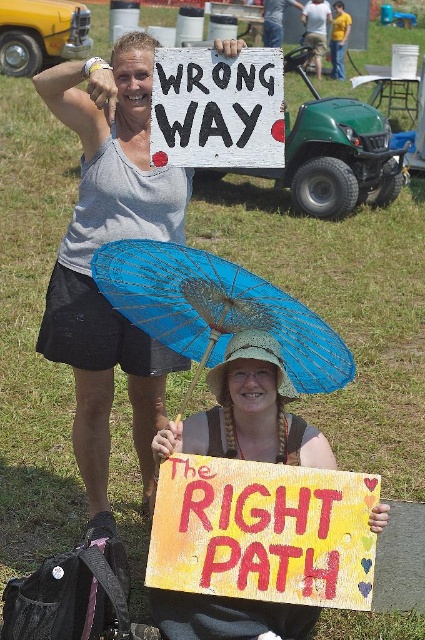
Question: Is the position of matte gray tank top at upper left less distant than that of blue paper parasol at lower center?

Choices:
 (A) yes
 (B) no

Answer: (B)

Question: Based on their relative distances, which object is nearer to the blue paper parasol at lower center?

Choices:
 (A) light blue fabric umbrella at center
 (B) yellow shirt at upper center
 (C) yellow painted wood sign at lower center
 (D) white paper sign at upper center

Answer: (C)

Question: Does white paper sign at upper center have a lesser width compared to yellow shirt at upper center?

Choices:
 (A) no
 (B) yes

Answer: (A)

Question: Among these objects, which one is farthest from the camera?

Choices:
 (A) yellow shirt at upper center
 (B) matte gray tank top at upper left

Answer: (A)

Question: Estimate the real-world distances between objects in this image. Which object is farther from the light blue fabric umbrella at center?

Choices:
 (A) blue paper parasol at lower center
 (B) yellow painted wood sign at lower center

Answer: (B)

Question: Is matte gray tank top at upper left above white paper sign at upper center?

Choices:
 (A) no
 (B) yes

Answer: (A)